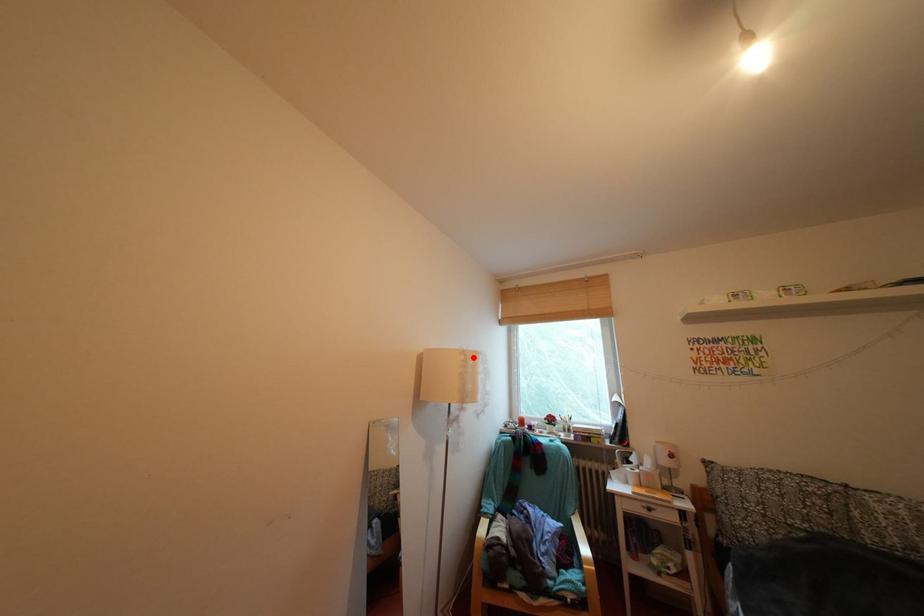
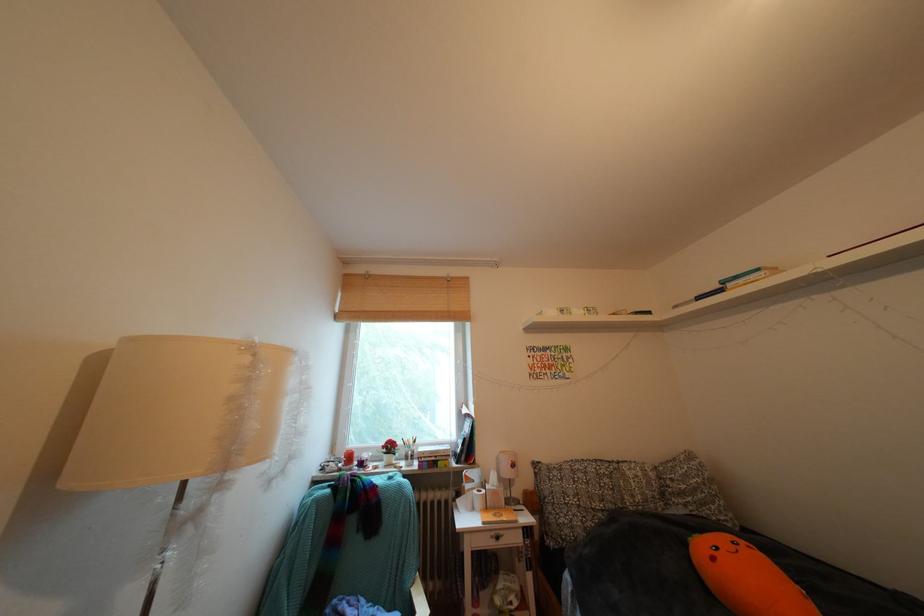
In the second image, find the point that corresponds to the highlighted location in the first image.

(259, 353)